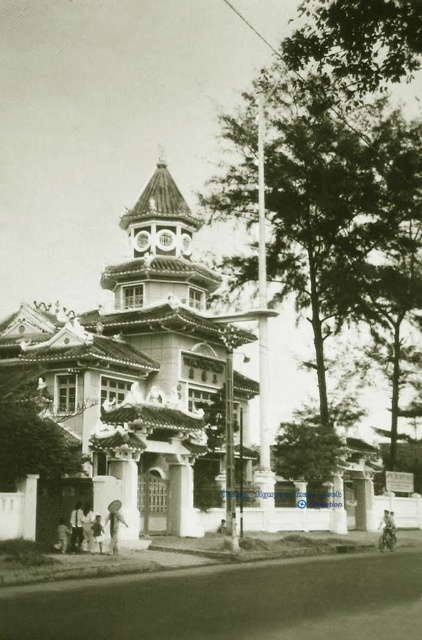
Question: Is smooth stone bell tower at center further to the viewer compared to white stone pillar at center?

Choices:
 (A) no
 (B) yes

Answer: (A)

Question: Is smooth stone bell tower at center bigger than white stone pillar at center?

Choices:
 (A) no
 (B) yes

Answer: (B)

Question: Among these points, which one is nearest to the camera?

Choices:
 (A) (337, 516)
 (B) (302, 497)

Answer: (B)

Question: Which of the following is the farthest from the observer?

Choices:
 (A) smooth stone bell tower at center
 (B) metallic silver motorcycle at lower right
 (C) white stone pillar at center

Answer: (C)

Question: Does white stone pillar at center have a greater width compared to white concrete pillar at center?

Choices:
 (A) yes
 (B) no

Answer: (B)

Question: Which of the following is the farthest from the observer?

Choices:
 (A) (192, 301)
 (B) (297, 500)
 (C) (392, 541)
 (D) (335, 486)

Answer: (A)